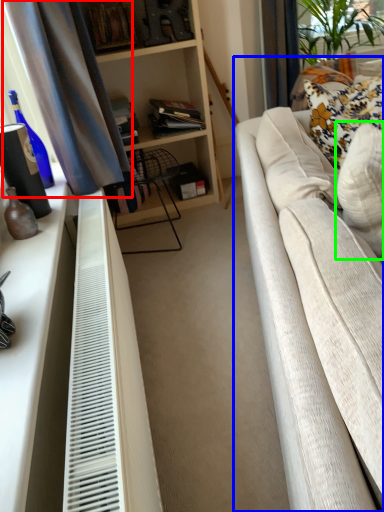
Question: Which object is positioned closest to curtain (highlighted by a red box)? Select from studio couch (highlighted by a blue box) and pillow (highlighted by a green box).

Choices:
 (A) studio couch
 (B) pillow

Answer: (A)